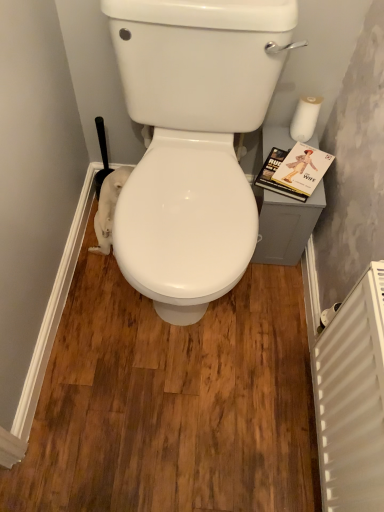
Question: From the image's perspective, is white matte toilet paper at upper right, placed as the first toilet paper when sorted from top to bottom, above white matte toilet paper at lower right, the 1th toilet paper in the left-to-right sequence?

Choices:
 (A) yes
 (B) no

Answer: (A)

Question: Is white matte toilet paper at upper right, which ranks as the 2th toilet paper in left-to-right order, smaller than white matte toilet paper at lower right, the 1th toilet paper in the left-to-right sequence?

Choices:
 (A) no
 (B) yes

Answer: (B)

Question: Is white matte toilet paper at upper right, which is counted as the second toilet paper, starting from the bottom, shorter than white matte toilet paper at lower right, the 2th toilet paper positioned from the top?

Choices:
 (A) no
 (B) yes

Answer: (B)

Question: Is white matte toilet paper at upper right, placed as the first toilet paper when sorted from top to bottom, looking in the opposite direction of white matte toilet paper at lower right, the 2th toilet paper positioned from the top?

Choices:
 (A) no
 (B) yes

Answer: (A)

Question: Is white matte toilet paper at upper right, which is counted as the second toilet paper, starting from the bottom, taller than white matte toilet paper at lower right, placed as the second toilet paper when sorted from right to left?

Choices:
 (A) yes
 (B) no

Answer: (B)

Question: Is white matte toilet paper at upper right, which is the 1th toilet paper in right-to-left order, to the right of white matte toilet paper at lower right, the 1th toilet paper in the left-to-right sequence, from the viewer's perspective?

Choices:
 (A) yes
 (B) no

Answer: (A)

Question: From a real-world perspective, is white matte toilet paper at upper right, placed as the first toilet paper when sorted from top to bottom, positioned over white plastic radiator at lower right based on gravity?

Choices:
 (A) no
 (B) yes

Answer: (B)

Question: Is the depth of white matte toilet paper at upper right, which is the 1th toilet paper in right-to-left order, greater than that of white plastic radiator at lower right?

Choices:
 (A) no
 (B) yes

Answer: (B)

Question: Is white matte toilet paper at upper right, which is counted as the second toilet paper, starting from the bottom, taller than white plastic radiator at lower right?

Choices:
 (A) yes
 (B) no

Answer: (B)

Question: From a real-world perspective, is white matte toilet paper at upper right, which is counted as the second toilet paper, starting from the bottom, below white plastic radiator at lower right?

Choices:
 (A) yes
 (B) no

Answer: (B)

Question: Is white matte toilet paper at upper right, which ranks as the 2th toilet paper in left-to-right order, thinner than white plastic radiator at lower right?

Choices:
 (A) yes
 (B) no

Answer: (B)

Question: Can we say white matte toilet paper at upper right, which ranks as the 2th toilet paper in left-to-right order, lies outside white plastic radiator at lower right?

Choices:
 (A) no
 (B) yes

Answer: (B)

Question: Considering the relative sizes of white plastic radiator at lower right and hardcover book at right in the image provided, is white plastic radiator at lower right bigger than hardcover book at right?

Choices:
 (A) no
 (B) yes

Answer: (B)